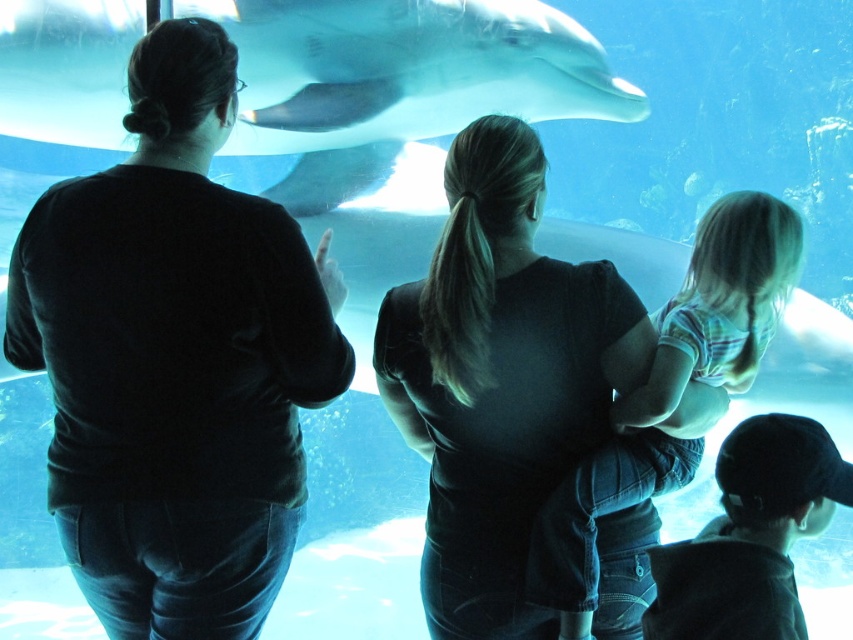
Can you confirm if white smooth dolphin at upper center is shorter than striped cotton shirt at center?

Indeed, white smooth dolphin at upper center has a lesser height compared to striped cotton shirt at center.

Does point (415, 122) come behind point (619, 404)?

Yes.

The image size is (853, 640). Identify the location of white smooth dolphin at upper center. (405, 68).

Which of these two, matte black shirt at upper left or black matte shirt at center, stands taller?

matte black shirt at upper left is taller.

Does matte black shirt at upper left appear on the left side of black matte shirt at center?

Yes, matte black shirt at upper left is to the left of black matte shirt at center.

Which is in front, point (160, 138) or point (515, 396)?

Positioned in front is point (160, 138).

This screenshot has width=853, height=640. In order to click on matte black shirt at upper left in this screenshot , I will do `click(175, 358)`.

Who is positioned more to the left, matte black shirt at upper left or white smooth dolphin at upper center?

matte black shirt at upper left

Can you confirm if matte black shirt at upper left is positioned to the right of white smooth dolphin at upper center?

Incorrect, matte black shirt at upper left is not on the right side of white smooth dolphin at upper center.

Is point (177, 177) farther from camera compared to point (131, 13)?

No, it is in front of (131, 13).

Identify the location of matte black shirt at upper left. Image resolution: width=853 pixels, height=640 pixels. (175, 358).